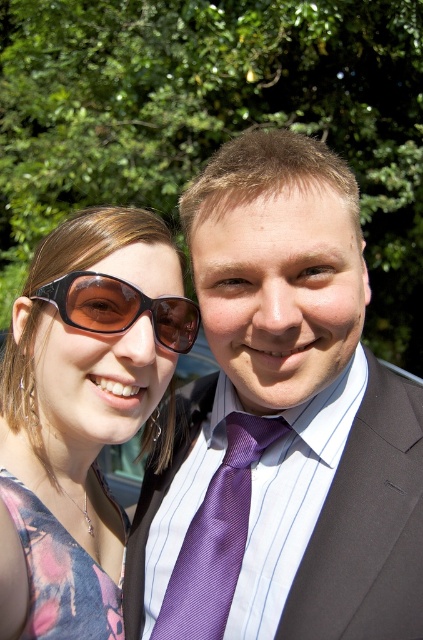
You are a photographer setting up for a portrait shoot. You need to ensure that the matte black sunglasses at left and the purple satin business suit at center are both visible in the frame. Given that the sunglasses are wider than the suit, which object should you adjust your camera angle to prioritize capturing first?

The matte black sunglasses at left should be prioritized since they are wider than the purple satin business suit at center, ensuring they fit within the frame first before adjusting for the narrower suit.

You are a photographer trying to adjust your camera focus to capture the matte black sunglasses at left. What are the coordinates where you should focus?

The coordinates for the matte black sunglasses at left are at point (84, 404).

You are a photographer adjusting your camera settings to focus on two points in the image. The first point is at coordinate point (412, 541) and the second is at point (46, 285). Which point should you focus on first if you want to ensure the closest object is in sharp focus?

Point (412, 541) is closer to the camera than point (46, 285), so you should focus on point (412, 541) first to ensure the closest object is in sharp focus.